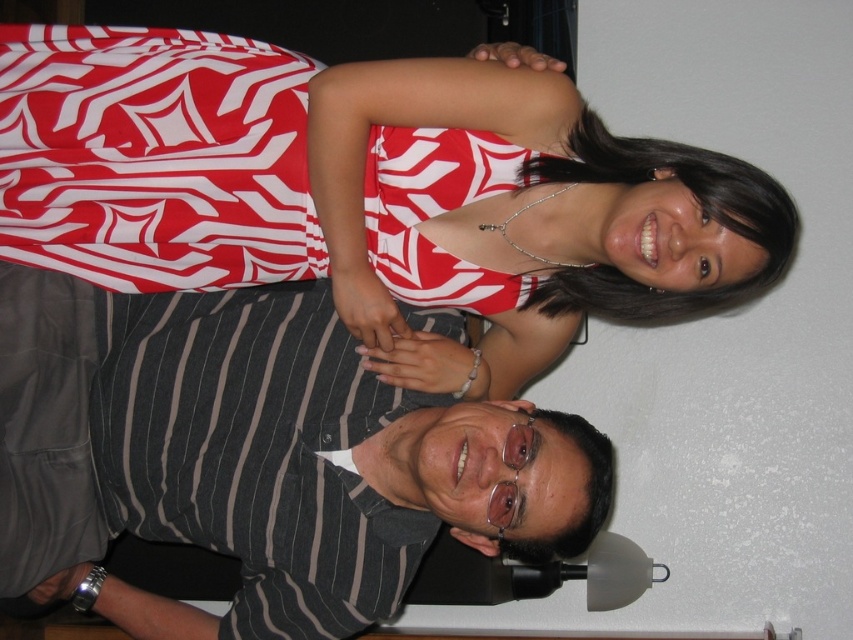
You are organizing a clothing donation drive and need to categorize items by size. You have two garments to sort out. The first is the white printed dress at upper center, and the second is the striped cotton shirt at lower center. Which garment should you place in the large size bin?

The white printed dress at upper center is larger in size than the striped cotton shirt at lower center, so you should place the white printed dress at upper center in the large size bin.

You are standing in front of the image and want to locate the white printed dress at upper center. Please provide its coordinates in the format of point with two decimal numbers separated by comma.

The white printed dress at upper center is located at point (x=367, y=189).

You are trying to decide which clothing item to take for a photoshoot. Both the white printed dress at upper center and the striped cotton shirt at lower center are available. Based on their sizes, which one is wider?

The white printed dress at upper center is wider than the striped cotton shirt at lower center according to the description.